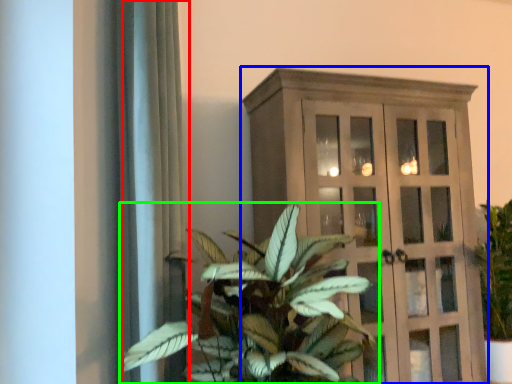
Question: Which is nearer to the curtain (highlighted by a red box)? cupboard (highlighted by a blue box) or houseplant (highlighted by a green box).

Choices:
 (A) cupboard
 (B) houseplant

Answer: (B)